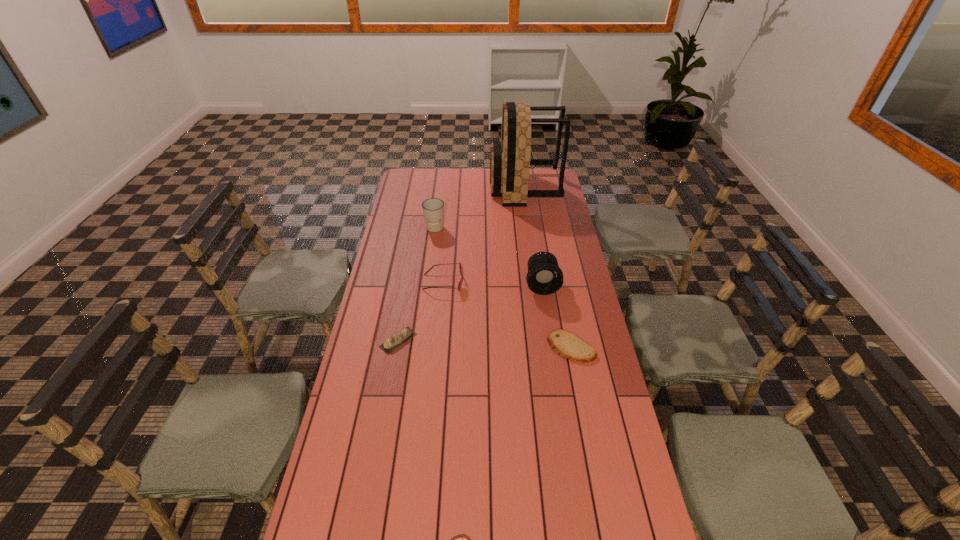
Locate an element on the screen. This screenshot has height=540, width=960. free space between the telephoto lens and the cup is located at coordinates [x=489, y=256].

Where is `vacant space in between the leftmost pita bread and the tallest object`? The width and height of the screenshot is (960, 540). vacant space in between the leftmost pita bread and the tallest object is located at coordinates (461, 264).

I want to click on free space that is in between the leftmost pita bread and the telephoto lens, so click(x=470, y=313).

At what (x,y) coordinates should I click in order to perform the action: click on object identified as the fifth closest to the rightmost pita bread. Please return your answer as a coordinate pair (x, y). The width and height of the screenshot is (960, 540). Looking at the image, I should click on (433, 209).

Select which object appears as the fourth closest to the second farthest object. Please provide its 2D coordinates. Your answer should be formatted as a tuple, i.e. [(x, y)], where the tuple contains the x and y coordinates of a point satisfying the conditions above.

[(396, 340)]

You are a GUI agent. You are given a task and a screenshot of the screen. Output one action in this format:
    pyautogui.click(x=<x>, y=<y>)
    Task: Click on the pita bread identified as the third closest to the sixth nearest object
    The width and height of the screenshot is (960, 540).
    Given the screenshot: What is the action you would take?
    pyautogui.click(x=462, y=539)

Find the location of `pita bread that stands as the closest to the backpack`. pita bread that stands as the closest to the backpack is located at coordinates (566, 344).

At what (x,y) coordinates should I click in order to perform the action: click on free space that satisfies the following two spatial constraints: 1. on the front-facing side of the fourth tallest object; 2. on the back side of the rightmost pita bread. Please return your answer as a coordinate pair (x, y). The image size is (960, 540). Looking at the image, I should click on (438, 347).

What are the coordinates of `vacant area that satisfies the following two spatial constraints: 1. on the front face of the farthest object; 2. on the right side of the rightmost pita bread` in the screenshot? It's located at (546, 347).

Locate an element on the screen. Image resolution: width=960 pixels, height=540 pixels. free space that satisfies the following two spatial constraints: 1. on the front-facing side of the rightmost pita bread; 2. on the left side of the fourth tallest object is located at coordinates (438, 347).